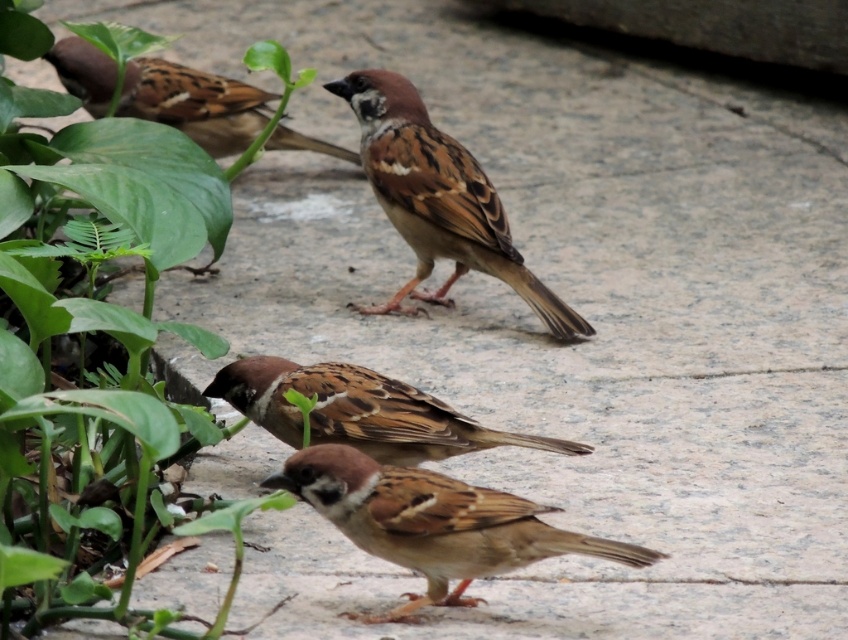
Question: Which point is closer to the camera?

Choices:
 (A) tap(322, 452)
 (B) tap(131, 67)
 (C) tap(419, 100)

Answer: (A)

Question: Does green leafy plant at lower left come in front of brown speckled sparrow at upper center?

Choices:
 (A) no
 (B) yes

Answer: (B)

Question: Which is nearer to the brown speckled sparrow at center?

Choices:
 (A) brown speckled feathers at center
 (B) green leafy plant at lower left
 (C) brown feathered sparrow at center

Answer: (B)

Question: Which object is positioned farthest from the green leafy plant at lower left?

Choices:
 (A) brown speckled sparrow at upper center
 (B) brown speckled sparrow at center
 (C) brown speckled feathers at center
 (D) brown feathered sparrow at center

Answer: (A)

Question: Observing the image, what is the correct spatial positioning of green leafy plant at lower left in reference to brown speckled sparrow at center?

Choices:
 (A) left
 (B) right

Answer: (A)

Question: Does green leafy plant at lower left have a smaller size compared to brown speckled sparrow at upper center?

Choices:
 (A) no
 (B) yes

Answer: (A)